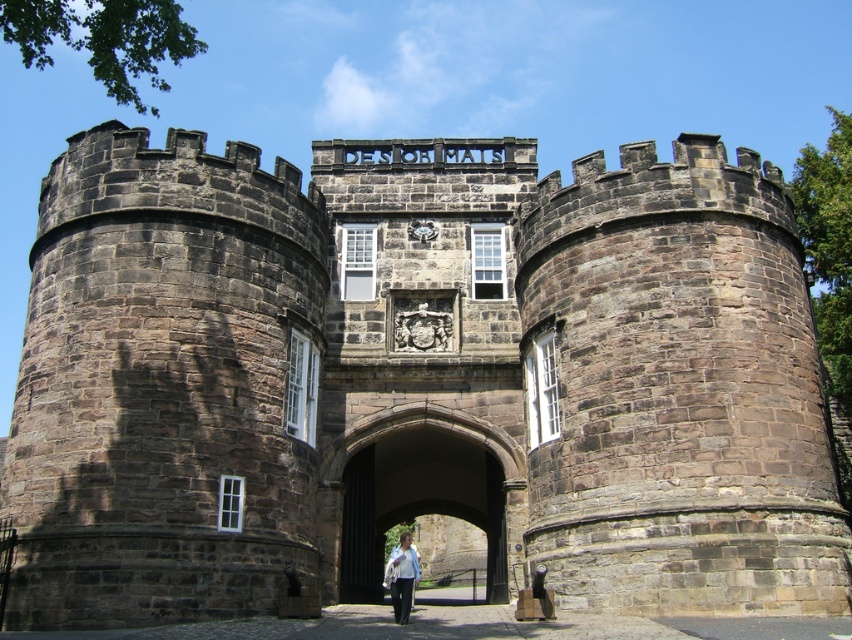
Question: From the image, what is the correct spatial relationship of dark stone archway at center in relation to white cotton shirt at center?

Choices:
 (A) right
 (B) left

Answer: (A)

Question: Does dark stone archway at center appear on the left side of white cotton shirt at center?

Choices:
 (A) no
 (B) yes

Answer: (A)

Question: Is dark stone archway at center behind white cotton shirt at center?

Choices:
 (A) no
 (B) yes

Answer: (B)